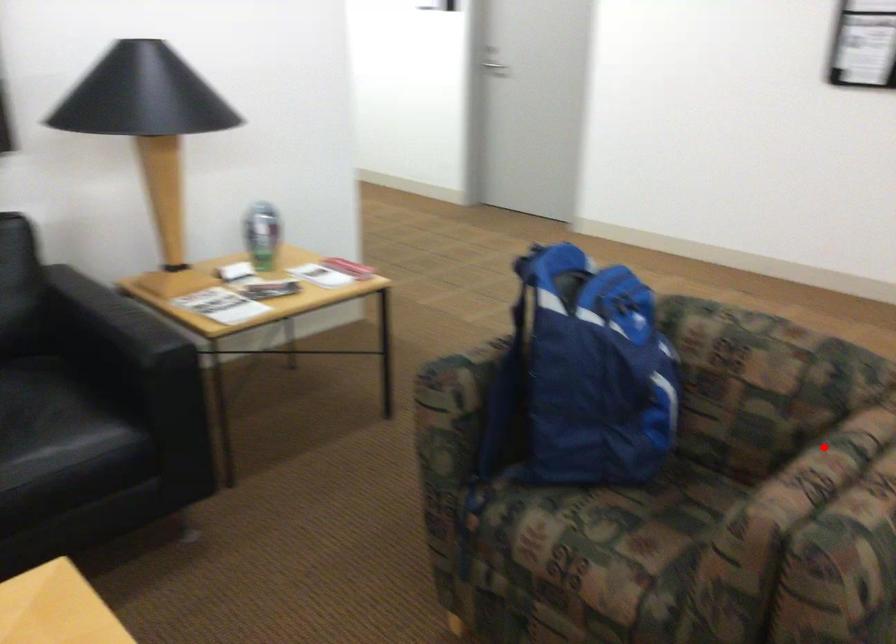
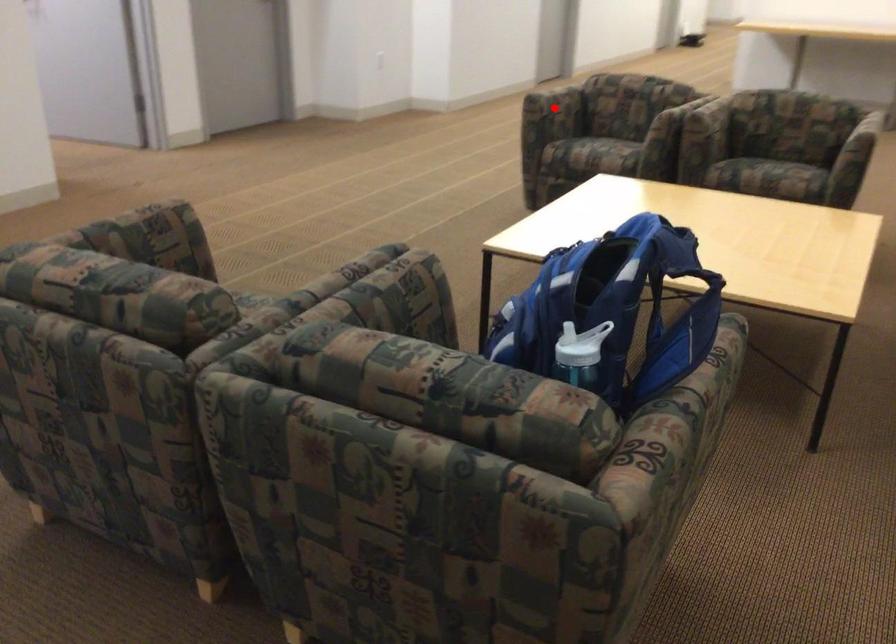
I am providing you with two images of the same scene from different viewpoints. A red point is marked on the first image and another point is marked on the second image. Do the highlighted points in image1 and image2 indicate the same real-world spot?

No